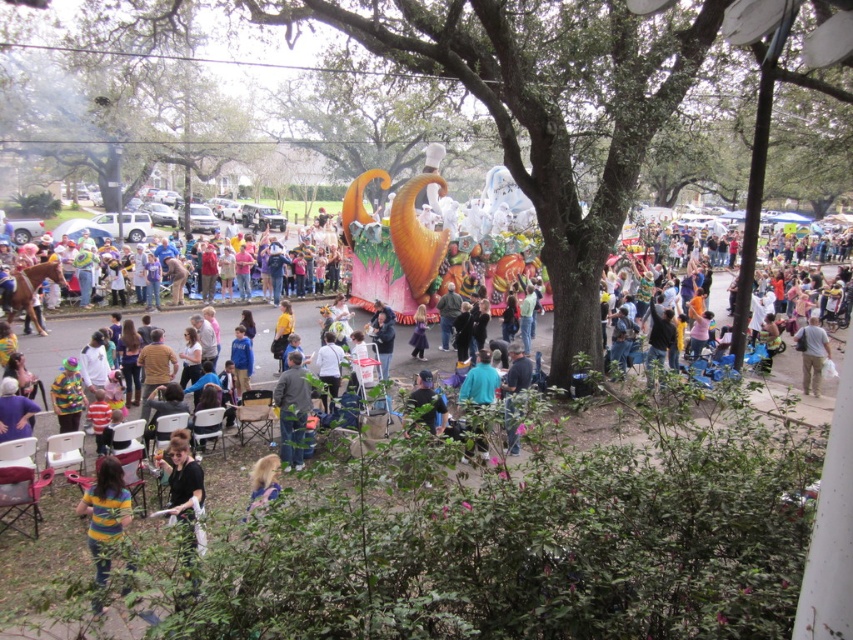
Question: Which object is positioned farthest from the blonde hair at lower left?

Choices:
 (A) green leafy tree at center
 (B) black shirt at lower left
 (C) gray cotton shirt at lower right
 (D) denim jacket at center

Answer: (C)

Question: Does black shirt at lower left appear over gray cotton shirt at lower right?

Choices:
 (A) yes
 (B) no

Answer: (B)

Question: Which point is farther from the camera taking this photo?

Choices:
 (A) (270, 458)
 (B) (177, 483)
 (C) (508, 92)
 (D) (126, 566)

Answer: (C)

Question: Does green leafy tree at center appear over gray cotton shirt at lower right?

Choices:
 (A) no
 (B) yes

Answer: (B)

Question: Does striped shirt at lower left appear on the left side of denim jacket at center?

Choices:
 (A) yes
 (B) no

Answer: (A)

Question: Which object is farther from the camera taking this photo?

Choices:
 (A) blonde hair at lower left
 (B) black shirt at lower left
 (C) green leafy tree at center
 (D) striped shirt at lower left

Answer: (D)